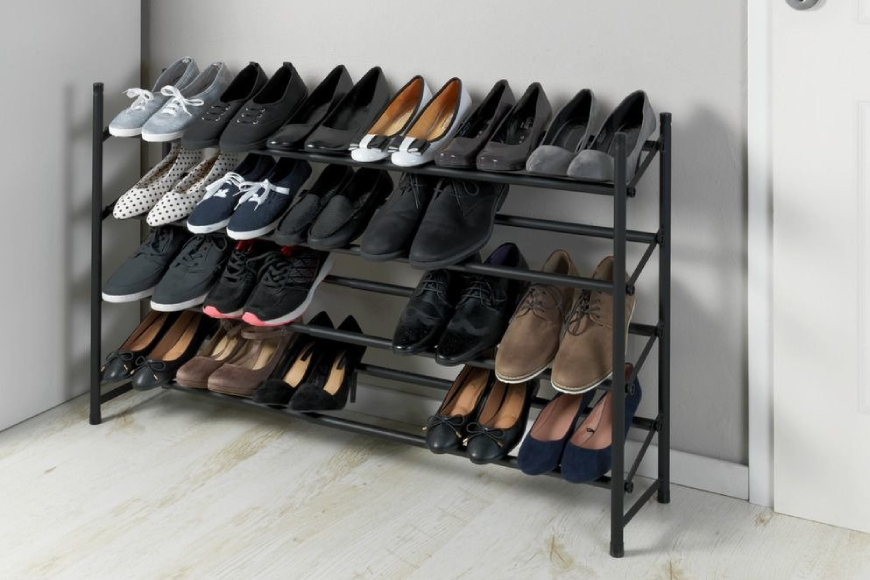
You are a GUI agent. You are given a task and a screenshot of the screen. Output one action in this format:
    pyautogui.click(x=<x>, y=<y>)
    Task: Click on the shelves with shoes on them
    The height and width of the screenshot is (580, 870).
    Given the screenshot: What is the action you would take?
    pyautogui.click(x=343, y=425), pyautogui.click(x=348, y=337), pyautogui.click(x=352, y=249), pyautogui.click(x=345, y=163)